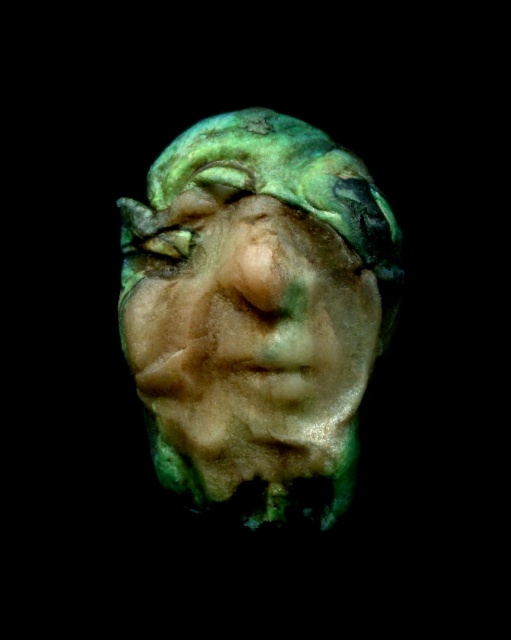
You are a painter standing 1.5 meters away from a green metallic mask at center. You want to move closer to paint it. How much closer can you get before you are right in front of it?

The green metallic mask at center is 1.21 meters away from the viewer. Since you are currently 1.5 meters away, you can move 0.29 meters closer to be right in front of it.

You are an art conservator examining the sculpted face. You notice two green elements at the center. Which one is closer to you, the green metallic mask at center or the green matte eye at center?

The green metallic mask at center is in front of the green matte eye at center, so the green metallic mask at center is closer to you.

You are an archaeologist examining the sculpted face. You notice two points on the sculpture labeled as point 1 at coordinate (x=226, y=445) and point 2 at coordinate (x=138, y=240). Which point is nearer to your viewpoint?

Point 1 at coordinate (x=226, y=445) is closer to the camera than point 2 at coordinate (x=138, y=240).